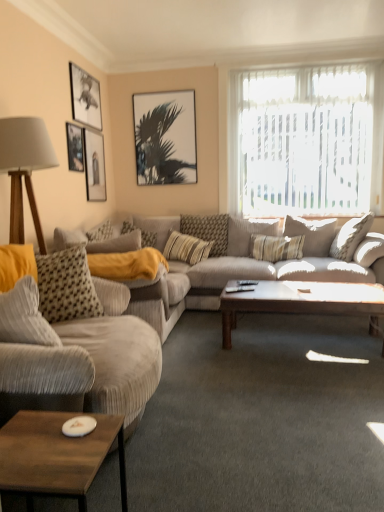
This screenshot has width=384, height=512. What do you see at coordinates (24, 168) in the screenshot?
I see `wooden tripod lamp at left` at bounding box center [24, 168].

The image size is (384, 512). Find the location of `wooden rectangular table at lower left, the 2th coffee table in the right-to-left sequence`. wooden rectangular table at lower left, the 2th coffee table in the right-to-left sequence is located at coordinates (56, 456).

Describe the element at coordinates (312, 234) in the screenshot. I see `striped fabric pillow at center, which is the fifth pillow from left to right` at that location.

Where is `translucent fabric at upper right`? translucent fabric at upper right is located at coordinates (306, 140).

From a real-world perspective, does striped fabric pillow at center, the first pillow from the right, sit lower than wooden tripod lamp at left?

Indeed, from a real-world perspective, striped fabric pillow at center, the first pillow from the right, is positioned beneath wooden tripod lamp at left.

Is striped fabric pillow at center, the first pillow from the right, not within wooden tripod lamp at left?

Yes, striped fabric pillow at center, the first pillow from the right, is not within wooden tripod lamp at left.

Can you tell me how much striped fabric pillow at center, the first pillow from the right, and wooden tripod lamp at left differ in facing direction?

They differ by 84.7 degrees in their facing directions.

Which object is thinner, striped fabric pillow at center, which is the fifth pillow from left to right, or wooden tripod lamp at left?

striped fabric pillow at center, which is the fifth pillow from left to right.

Would you consider yellow corduroy pillow at center, positioned as the fifth pillow in right-to-left order, to be distant from striped fabric pillow at center, which is the fifth pillow from left to right?

Yes, yellow corduroy pillow at center, positioned as the fifth pillow in right-to-left order, and striped fabric pillow at center, which is the fifth pillow from left to right, are quite far apart.

Is point (153, 244) positioned in front of point (288, 226)?

No.

From the picture: Considering the relative positions of yellow corduroy pillow at center, which is the first pillow in left-to-right order, and striped fabric pillow at center, the first pillow from the right, in the image provided, is yellow corduroy pillow at center, which is the first pillow in left-to-right order, to the right of striped fabric pillow at center, the first pillow from the right, from the viewer's perspective?

Incorrect, yellow corduroy pillow at center, which is the first pillow in left-to-right order, is not on the right side of striped fabric pillow at center, the first pillow from the right.

From a real-world perspective, count 1st pillows downward from the striped fabric pillow at center, the first pillow from the right, and point to it. Please provide its 2D coordinates.

[(148, 239)]

Locate an element on the screen. the 2nd coffee table directly beneath the velvet gray couch at left, acting as the 1th studio couch starting from the front (from a real-world perspective) is located at coordinates (302, 301).

Is velvet gray couch at left, acting as the 1th studio couch starting from the front, oriented towards wooden coffee table at center, which appears as the second coffee table when viewed from the front?

Yes, velvet gray couch at left, acting as the 1th studio couch starting from the front, is oriented towards wooden coffee table at center, which appears as the second coffee table when viewed from the front.

Can you confirm if velvet gray couch at left, acting as the 1th studio couch starting from the front, is positioned to the left of wooden coffee table at center, the 2th coffee table from the left?

Correct, you'll find velvet gray couch at left, acting as the 1th studio couch starting from the front, to the left of wooden coffee table at center, the 2th coffee table from the left.

Is velvet gray couch at left, the second studio couch when ordered from back to front, further to camera compared to wooden coffee table at center, the first coffee table viewed from the back?

That is False.

Considering the sizes of objects black matte picture frame at upper center, which is the 4th picture frame from left to right, and wooden coffee table at center, which is counted as the first coffee table, starting from the right, in the image provided, who is wider, black matte picture frame at upper center, which is the 4th picture frame from left to right, or wooden coffee table at center, which is counted as the first coffee table, starting from the right,?

Wider between the two is wooden coffee table at center, which is counted as the first coffee table, starting from the right.

Is black matte picture frame at upper center, which is the 4th picture frame from left to right, completely or partially outside of wooden coffee table at center, the first coffee table viewed from the back?

Yes, black matte picture frame at upper center, which is the 4th picture frame from left to right, is located beyond the bounds of wooden coffee table at center, the first coffee table viewed from the back.

Does black matte picture frame at upper center, which is the first picture frame from right to left, have a larger size compared to wooden coffee table at center, the first coffee table viewed from the back?

No.

Which of these two, black matte picture frame at upper center, which is the 4th picture frame from left to right, or wooden coffee table at center, which appears as the second coffee table when viewed from the front, stands shorter?

wooden coffee table at center, which appears as the second coffee table when viewed from the front.

In the image, is textured beige couch at center, which ranks as the first studio couch in back-to-front order, positioned in front of or behind matte black picture frame at upper left, which appears as the 3th picture frame when viewed from the right?

In the image, textured beige couch at center, which ranks as the first studio couch in back-to-front order, appears in front of matte black picture frame at upper left, which appears as the 3th picture frame when viewed from the right.

Considering the sizes of objects textured beige couch at center, the second studio couch from the front, and matte black picture frame at upper left, arranged as the second picture frame when viewed from the left, in the image provided, who is smaller, textured beige couch at center, the second studio couch from the front, or matte black picture frame at upper left, arranged as the second picture frame when viewed from the left,?

matte black picture frame at upper left, arranged as the second picture frame when viewed from the left, is smaller.

Is point (309, 275) more distant than point (80, 85)?

No.

Is there a large distance between matte black picture frame at upper left, the second picture frame when ordered from right to left, and striped fabric pillow at center, which is the 2th pillow in left-to-right order?

That's right, there is a large distance between matte black picture frame at upper left, the second picture frame when ordered from right to left, and striped fabric pillow at center, which is the 2th pillow in left-to-right order.

Is point (97, 156) in front of point (208, 246)?

No, it is not.

From a real-world perspective, who is located lower, matte black picture frame at upper left, which appears as the third picture frame when viewed from the left, or striped fabric pillow at center, which ranks as the fourth pillow in right-to-left order?

From a 3D spatial view, striped fabric pillow at center, which ranks as the fourth pillow in right-to-left order, is below.

Is matte black picture frame at upper left, the second picture frame when ordered from right to left, not within striped fabric pillow at center, which is the 2th pillow in left-to-right order?

Yes, matte black picture frame at upper left, the second picture frame when ordered from right to left, is outside of striped fabric pillow at center, which is the 2th pillow in left-to-right order.

Between point (139, 102) and point (79, 167), which one is positioned in front?

Point (79, 167)

From a real-world perspective, is black matte picture frame at upper center, which is the first picture frame from right to left, positioned above or below matte black picture frame at upper left, placed as the fourth picture frame when sorted from right to left?

In terms of real-world spatial position, black matte picture frame at upper center, which is the first picture frame from right to left, is above matte black picture frame at upper left, placed as the fourth picture frame when sorted from right to left.

Considering the positions of objects black matte picture frame at upper center, which is the first picture frame from right to left, and matte black picture frame at upper left, placed as the fourth picture frame when sorted from right to left, in the image provided, who is more to the left, black matte picture frame at upper center, which is the first picture frame from right to left, or matte black picture frame at upper left, placed as the fourth picture frame when sorted from right to left,?

matte black picture frame at upper left, placed as the fourth picture frame when sorted from right to left.

Is black matte picture frame at upper center, which is the 4th picture frame from left to right, positioned with its back to matte black picture frame at upper left, arranged as the 1th picture frame when viewed from the left?

black matte picture frame at upper center, which is the 4th picture frame from left to right, does not have its back to matte black picture frame at upper left, arranged as the 1th picture frame when viewed from the left.

Identify the location of table lamp above the striped fabric pillow at center, which is the fifth pillow from left to right (from the image's perspective). This screenshot has height=512, width=384. (24, 168).

Find the location of `the 4th pillow to the right of the yellow corduroy pillow at center, positioned as the fifth pillow in right-to-left order, starting your count from the anchor`. the 4th pillow to the right of the yellow corduroy pillow at center, positioned as the fifth pillow in right-to-left order, starting your count from the anchor is located at coordinates (312, 234).

Looking at the image, which one is located closer to striped fabric pillow at center, which ranks as the fourth pillow in right-to-left order, textured beige couch at center, which ranks as the first studio couch in back-to-front order, or yellow corduroy pillow at center, which is the first pillow in left-to-right order?

Among the two, yellow corduroy pillow at center, which is the first pillow in left-to-right order, is located nearer to striped fabric pillow at center, which ranks as the fourth pillow in right-to-left order.

Based on their spatial positions, is yellow corduroy pillow at center, which is the first pillow in left-to-right order, or black matte picture frame at upper center, which is the 4th picture frame from left to right, further from striped fabric pillow at center, the first pillow from the right?

The object further to striped fabric pillow at center, the first pillow from the right, is black matte picture frame at upper center, which is the 4th picture frame from left to right.

In the scene shown: Looking at the image, which one is located further to striped fabric pillow at center, which is the 2th pillow in left-to-right order, yellow corduroy pillow at center, positioned as the fifth pillow in right-to-left order, or striped fabric pillow at center, arranged as the 3th pillow when viewed from the right?

Among the two, yellow corduroy pillow at center, positioned as the fifth pillow in right-to-left order, is located further to striped fabric pillow at center, which is the 2th pillow in left-to-right order.

Estimate the real-world distances between objects in this image. Which object is closer to textured beige couch at center, which ranks as the first studio couch in back-to-front order, matte black picture frame at upper left, arranged as the 1th picture frame when viewed from the left, or translucent fabric at upper right?

Based on the image, translucent fabric at upper right appears to be nearer to textured beige couch at center, which ranks as the first studio couch in back-to-front order.

Which object lies nearer to the anchor point yellow corduroy pillow at center, positioned as the fifth pillow in right-to-left order, wooden rectangular table at lower left, which is the first coffee table from front to back, or translucent fabric at upper right?

translucent fabric at upper right is positioned closer to the anchor yellow corduroy pillow at center, positioned as the fifth pillow in right-to-left order.

Consider the image. Based on their spatial positions, is matte black picture frame at upper left, the second picture frame when ordered from right to left, or striped fabric pillow at center, positioned as the third pillow in left-to-right order, closer to black matte picture frame at upper center, which is the first picture frame from right to left?

matte black picture frame at upper left, the second picture frame when ordered from right to left, is closer to black matte picture frame at upper center, which is the first picture frame from right to left.

Estimate the real-world distances between objects in this image. Which object is closer to matte black picture frame at upper left, which appears as the third picture frame when viewed from the left, black matte picture frame at upper center, which is the 4th picture frame from left to right, or translucent fabric at upper right?

Based on the image, black matte picture frame at upper center, which is the 4th picture frame from left to right, appears to be nearer to matte black picture frame at upper left, which appears as the third picture frame when viewed from the left.

Considering their positions, is matte black picture frame at upper left, arranged as the 1th picture frame when viewed from the left, positioned closer to striped fabric pillow at center, arranged as the 3th pillow when viewed from the right, than matte black picture frame at upper left, the second picture frame when ordered from right to left?

matte black picture frame at upper left, the second picture frame when ordered from right to left, is positioned closer to the anchor striped fabric pillow at center, arranged as the 3th pillow when viewed from the right.

Find the location of a particular element. Image resolution: width=384 pixels, height=512 pixels. table lamp between velvet gray couch at left, acting as the 1th studio couch starting from the front, and matte black picture frame at upper left, the second picture frame when ordered from right to left, in the front-back direction is located at coordinates (24, 168).

The image size is (384, 512). Find the location of `picture frame between matte black picture frame at upper left, placed as the fourth picture frame when sorted from right to left, and yellow corduroy pillow at center, positioned as the fifth pillow in right-to-left order, in the up-down direction`. picture frame between matte black picture frame at upper left, placed as the fourth picture frame when sorted from right to left, and yellow corduroy pillow at center, positioned as the fifth pillow in right-to-left order, in the up-down direction is located at coordinates (95, 166).

Where is `coffee table positioned between wooden rectangular table at lower left, which is the first coffee table from front to back, and yellow corduroy pillow at center, which is the first pillow in left-to-right order, from near to far`? The width and height of the screenshot is (384, 512). coffee table positioned between wooden rectangular table at lower left, which is the first coffee table from front to back, and yellow corduroy pillow at center, which is the first pillow in left-to-right order, from near to far is located at coordinates (302, 301).

The height and width of the screenshot is (512, 384). Find the location of `coffee table between velvet gray couch at left, acting as the 1th studio couch starting from the front, and translucent fabric at upper right, along the z-axis`. coffee table between velvet gray couch at left, acting as the 1th studio couch starting from the front, and translucent fabric at upper right, along the z-axis is located at coordinates (302, 301).